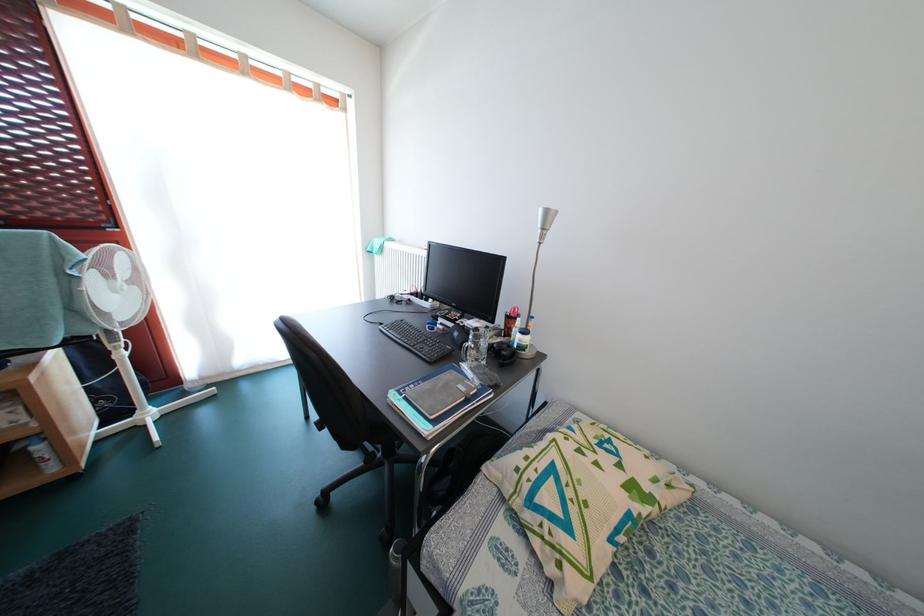
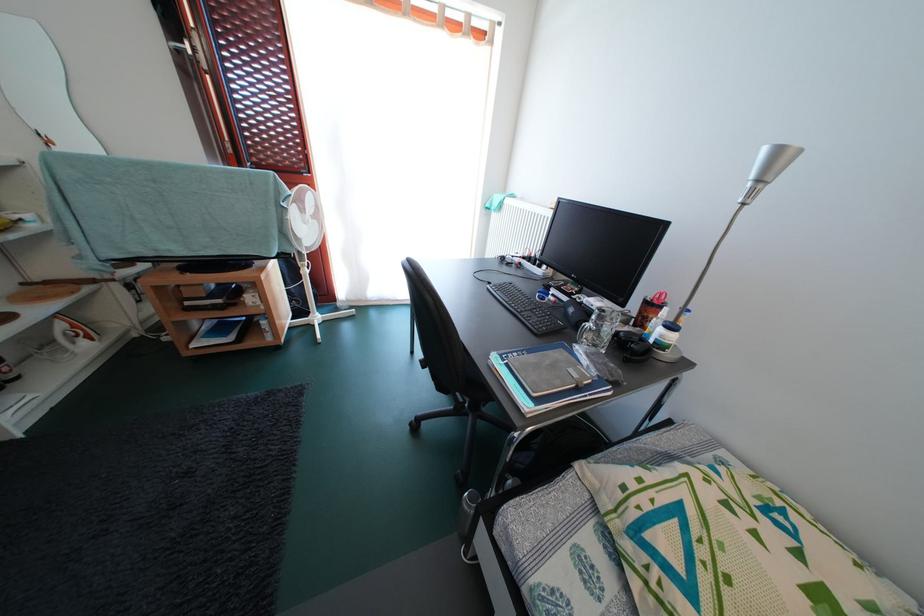
In the second image, find the point that corresponds to point 483,365 in the first image.

(602, 351)